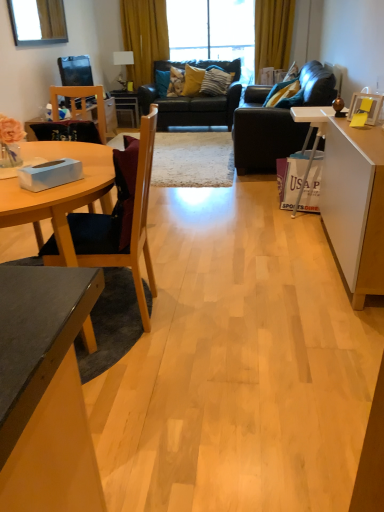
Question: From their relative heights in the image, would you say wooden picture frame at right is taller or shorter than transparent glass window at upper center?

Choices:
 (A) tall
 (B) short

Answer: (B)

Question: From a real-world perspective, relative to transparent glass window at upper center, is wooden picture frame at right vertically above or below?

Choices:
 (A) below
 (B) above

Answer: (A)

Question: Considering the real-world distances, which object is farthest from the dark brown leather couch at right, the first studio couch positioned from the front?

Choices:
 (A) velvet blue pillow at upper right, which is the 4th pillow from back to front
 (B) wooden picture frame at right
 (C) transparent glass window at upper center
 (D) white glossy cabinet at right
 (E) metallic silver side table at center

Answer: (C)

Question: Considering the real-world distances, which object is closest to the clear glass window at upper left?

Choices:
 (A) wooden chair at left, which is the second chair in right-to-left order
 (B) metallic silver side table at center
 (C) white glossy cabinet at right
 (D) wooden picture frame at right
 (E) yellow fabric curtain at upper center, which ranks as the 1th curtain in right-to-left order

Answer: (B)